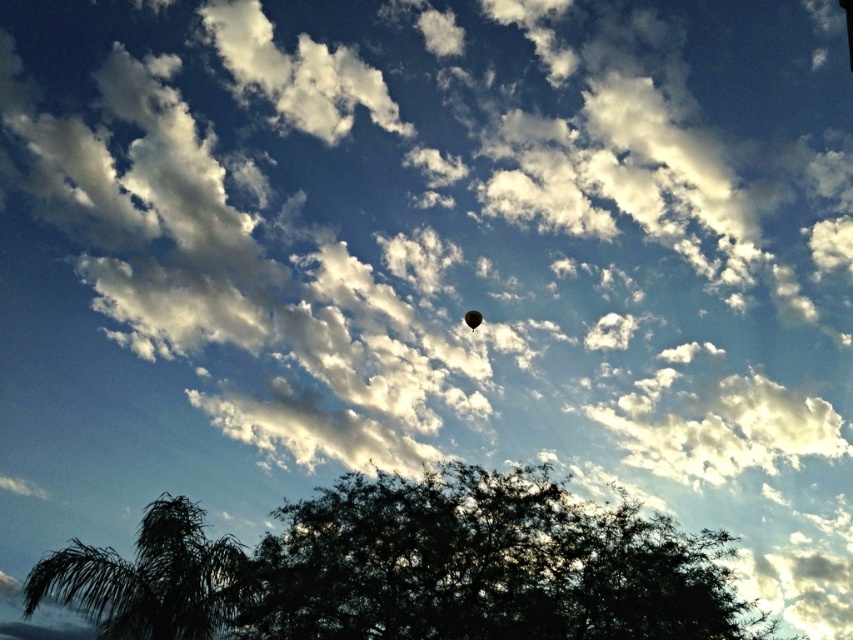
Which of these two, green leafy tree at lower left or green rubber balloon at upper center, stands taller?

Standing taller between the two is green leafy tree at lower left.

Does point (167, 592) lie behind point (468, 317)?

No.

Is point (53, 563) in front of point (469, 321)?

Yes.

Locate an element on the screen. The image size is (853, 640). green leafy tree at lower left is located at coordinates (149, 579).

Who is higher up, dark green leafy tree at center or green rubber balloon at upper center?

green rubber balloon at upper center is higher up.

From the picture: Is dark green leafy tree at center wider than green rubber balloon at upper center?

Indeed, dark green leafy tree at center has a greater width compared to green rubber balloon at upper center.

Where is `dark green leafy tree at center`? This screenshot has width=853, height=640. dark green leafy tree at center is located at coordinates (485, 564).

Locate an element on the screen. The height and width of the screenshot is (640, 853). dark green leafy tree at center is located at coordinates click(x=485, y=564).

Consider the image. Does dark green leafy tree at center appear on the left side of green leafy tree at lower left?

In fact, dark green leafy tree at center is to the right of green leafy tree at lower left.

Can you confirm if dark green leafy tree at center is wider than green leafy tree at lower left?

Yes.

Is point (589, 563) in front of point (126, 595)?

No, (589, 563) is behind (126, 595).

In order to click on dark green leafy tree at center in this screenshot , I will do `click(485, 564)`.